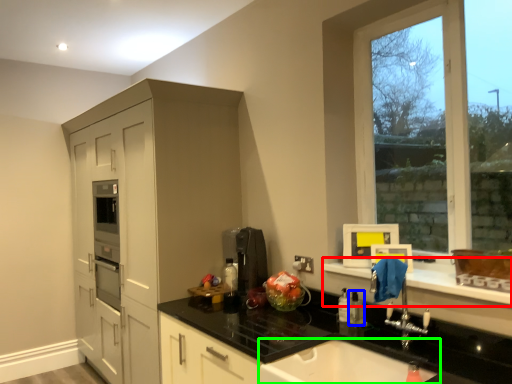
Question: Considering the real-world distances, which object is farthest from window sill (highlighted by a red box)? toiletry (highlighted by a blue box) or sink (highlighted by a green box)?

Choices:
 (A) toiletry
 (B) sink

Answer: (B)